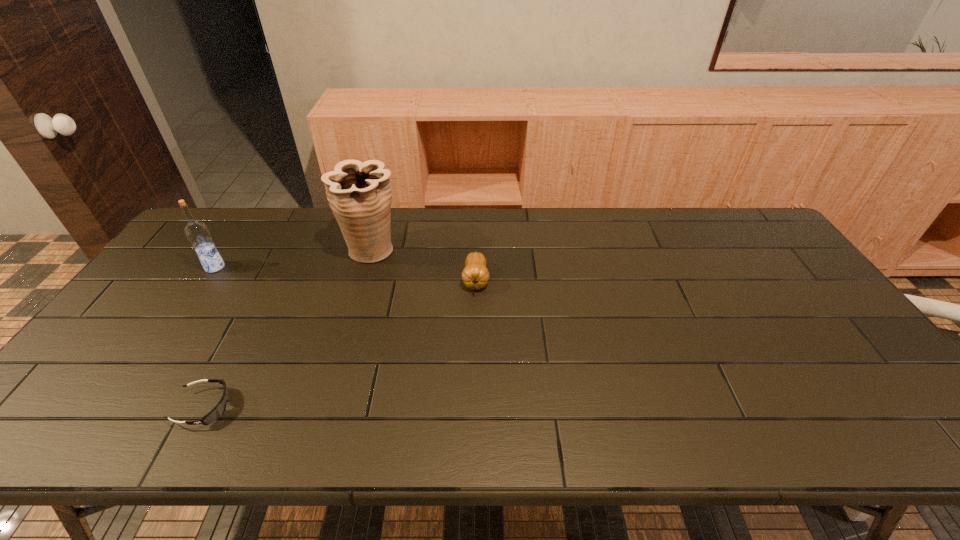
Point out which object is positioned as the third nearest to the vodka. Please provide its 2D coordinates. Your answer should be formatted as a tuple, i.e. [(x, y)], where the tuple contains the x and y coordinates of a point satisfying the conditions above.

[(475, 275)]

Locate which object ranks third in proximity to the leftmost object. Please provide its 2D coordinates. Your answer should be formatted as a tuple, i.e. [(x, y)], where the tuple contains the x and y coordinates of a point satisfying the conditions above.

[(475, 275)]

Find the location of `free space in the image that satisfies the following two spatial constraints: 1. on the stem side of the second shortest object; 2. on the front and sides of the third object from right to left`. free space in the image that satisfies the following two spatial constraints: 1. on the stem side of the second shortest object; 2. on the front and sides of the third object from right to left is located at coordinates (474, 407).

The height and width of the screenshot is (540, 960). In order to click on vacant region that satisfies the following two spatial constraints: 1. on the back side of the second object from right to left; 2. on the right side of the vodka in this screenshot , I will do tap(227, 249).